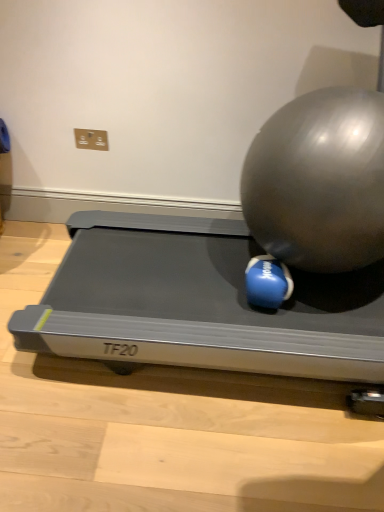
Find the location of a particular element. empty space that is ontop of silver metallic treadmill at center (from a real-world perspective) is located at coordinates (153, 386).